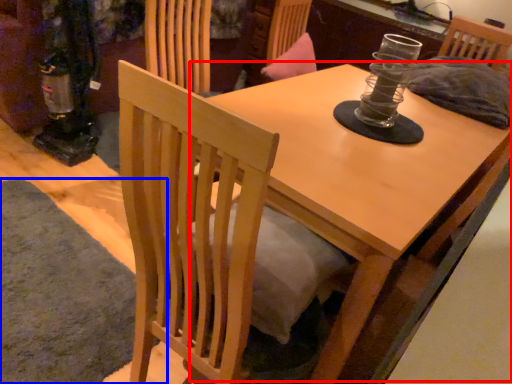
Question: Among these objects, which one is nearest to the camera, round table (highlighted by a red box) or mat (highlighted by a blue box)?

Choices:
 (A) round table
 (B) mat

Answer: (A)